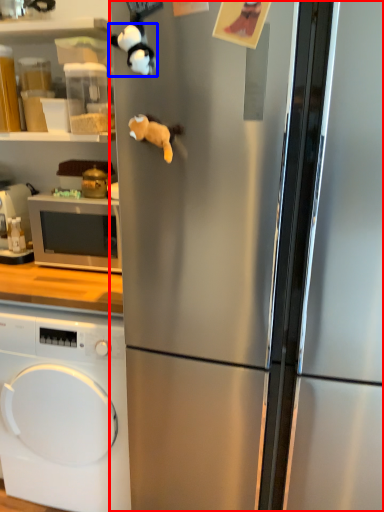
Question: Which object appears closest to the camera in this image, refrigerator (highlighted by a red box) or animal (highlighted by a blue box)?

Choices:
 (A) refrigerator
 (B) animal

Answer: (A)